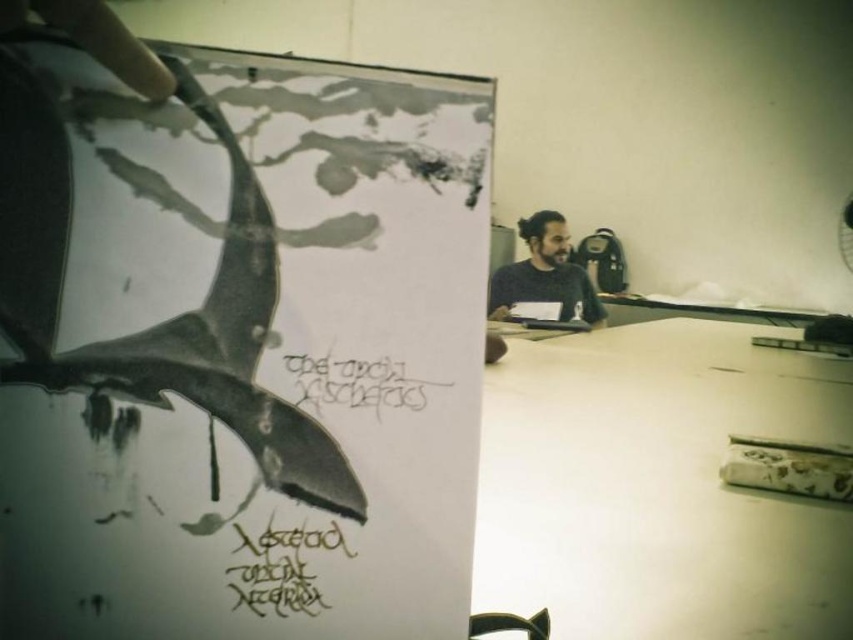
Between point (262, 596) and point (526, 268), which one is positioned in front?

Point (262, 596)

Is brown calligraphy at center smaller than black matte shirt at upper right?

Yes, brown calligraphy at center is smaller than black matte shirt at upper right.

Find the location of `brown calligraphy at center`. brown calligraphy at center is located at coordinates (281, 570).

Is black matte shirt at upper right below black ink writing at center?

No.

Is black matte shirt at upper right to the left of black ink writing at center from the viewer's perspective?

In fact, black matte shirt at upper right is to the right of black ink writing at center.

At what (x,y) coordinates should I click in order to perform the action: click on black matte shirt at upper right. Please return your answer as a coordinate pair (x, y). Looking at the image, I should click on (544, 273).

Locate an element on the screen. The height and width of the screenshot is (640, 853). black matte shirt at upper right is located at coordinates (544, 273).

Is point (257, 144) closer to viewer compared to point (265, 536)?

Yes, it is in front of point (265, 536).

Is point (218, 582) positioned behind point (274, 540)?

That is False.

At what (x,y) coordinates should I click in order to perform the action: click on black paper poster at left. Please return your answer as a coordinate pair (x, y). This screenshot has width=853, height=640. Looking at the image, I should click on (233, 340).